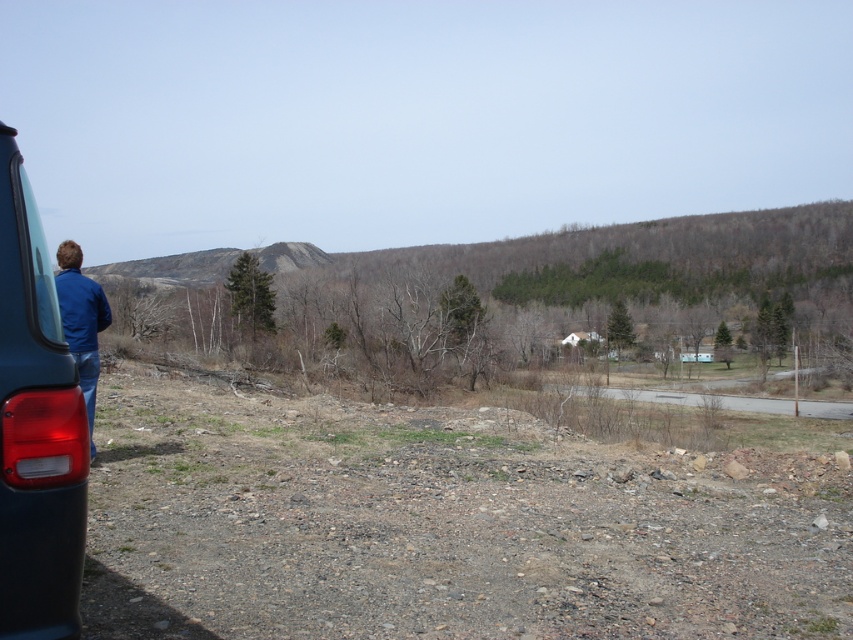
You are standing near a vehicle in a rural area. You notice a point located at coordinates (35, 428). Based on the scene description, can you determine which object this point belongs to?

The point at coordinates (35, 428) is on the matte black car at left.

In the scene shown: You are standing near the matte black car at left and the blue denim jacket at left in the rural landscape. Which object is closer to you?

The blue denim jacket at left is closer to you because it is larger than the matte black car at left, which is smaller and therefore farther away.

You are standing near a vehicle in a rural area. You notice two points marked on the ground. The first point is at coordinate point (56, 605) and the second is at point (96, 324). Which point is closer to your current position?

Point (56, 605) is in front of point (96, 324), so it is closer to your current position.